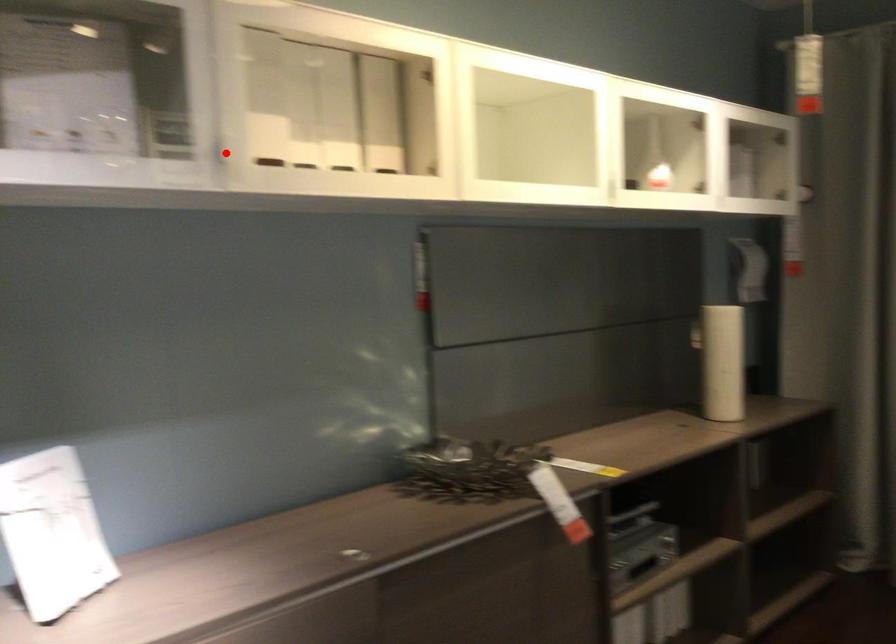
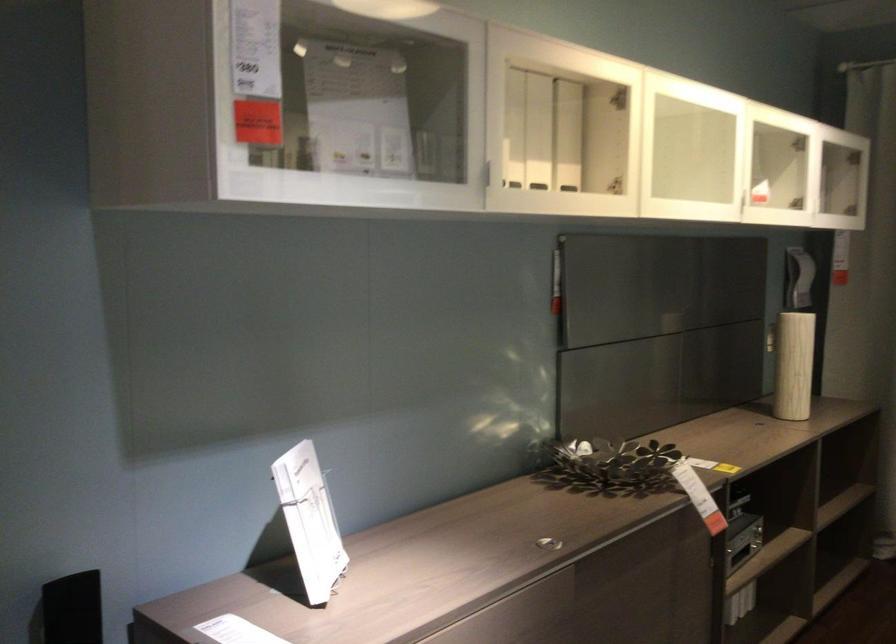
The point at the highlighted location is marked in the first image. Where is the corresponding point in the second image?

(487, 174)